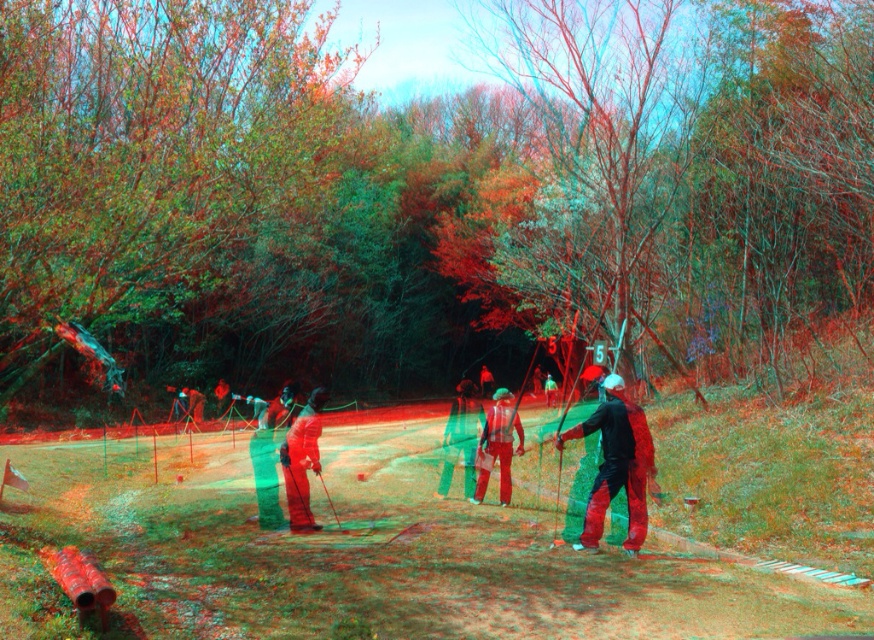
You are an archer in the scene and need to retrieve your matte black jacket at center. Where should you look to find it?

The matte black jacket at center is located at point (616,465).